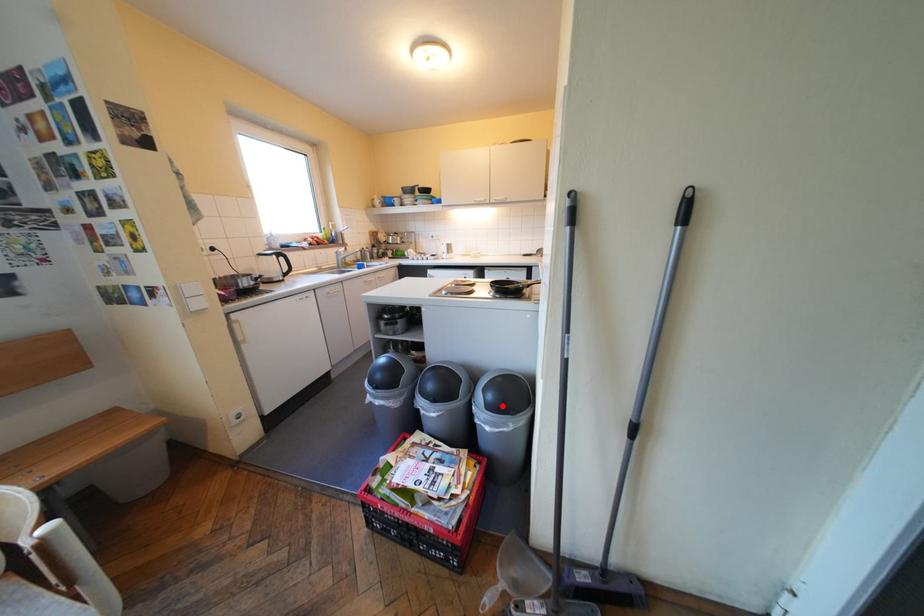
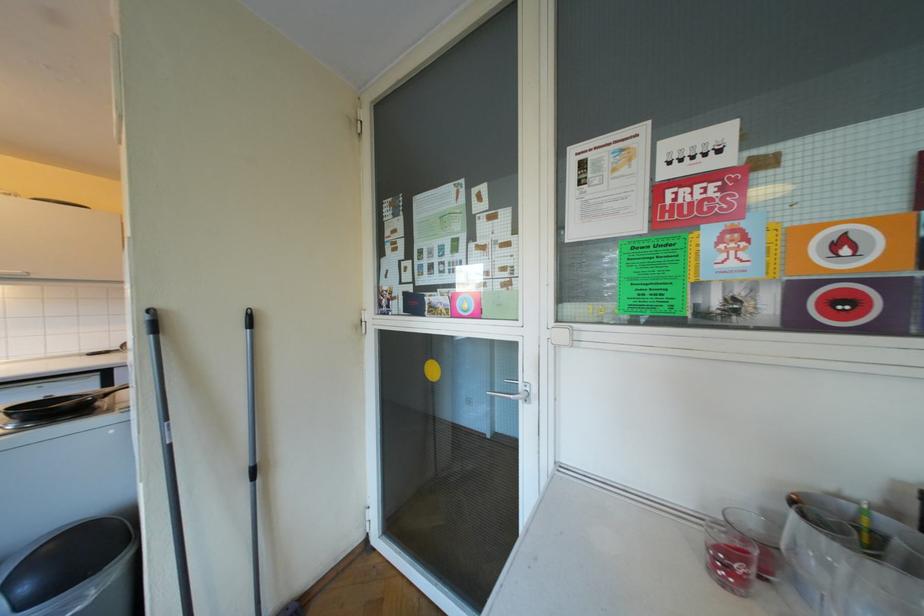
Find the pixel in the second image that matches the highlighted location in the first image.

(40, 602)